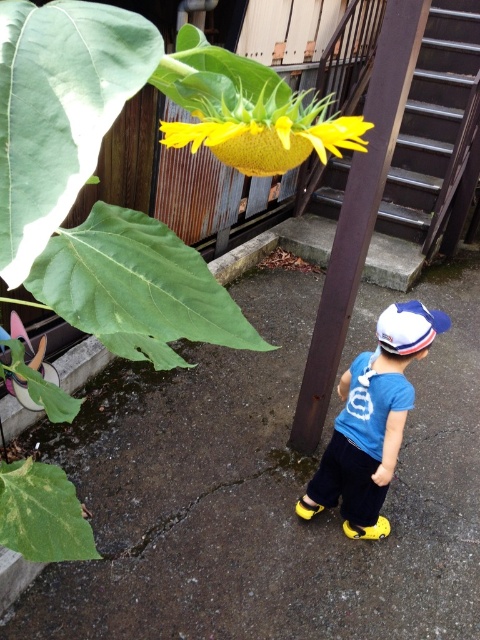
Is brown wood pole at center positioned at the back of blue cotton shirt at lower right?

No, it is not.

Can you confirm if brown wood pole at center is bigger than blue cotton shirt at lower right?

Yes.

Which is behind, point (308, 365) or point (357, 520)?

Point (308, 365)

The height and width of the screenshot is (640, 480). I want to click on brown wood pole at center, so click(359, 212).

Does blue cotton shirt at lower right have a greater height compared to white fabric baseball cap at lower center?

Yes, blue cotton shirt at lower right is taller than white fabric baseball cap at lower center.

Which is in front, point (386, 390) or point (400, 301)?

Point (386, 390)

What do you see at coordinates (372, 420) in the screenshot? The height and width of the screenshot is (640, 480). I see `blue cotton shirt at lower right` at bounding box center [372, 420].

I want to click on blue cotton shirt at lower right, so click(372, 420).

Which is above, brown wood pole at center or white fabric baseball cap at lower center?

brown wood pole at center

Is brown wood pole at center taller than white fabric baseball cap at lower center?

Yes, brown wood pole at center is taller than white fabric baseball cap at lower center.

Between point (344, 273) and point (377, 333), which one is positioned behind?

The point (344, 273) is behind.

At what (x,y) coordinates should I click in order to perform the action: click on brown wood pole at center. Please return your answer as a coordinate pair (x, y). The image size is (480, 640). Looking at the image, I should click on (359, 212).